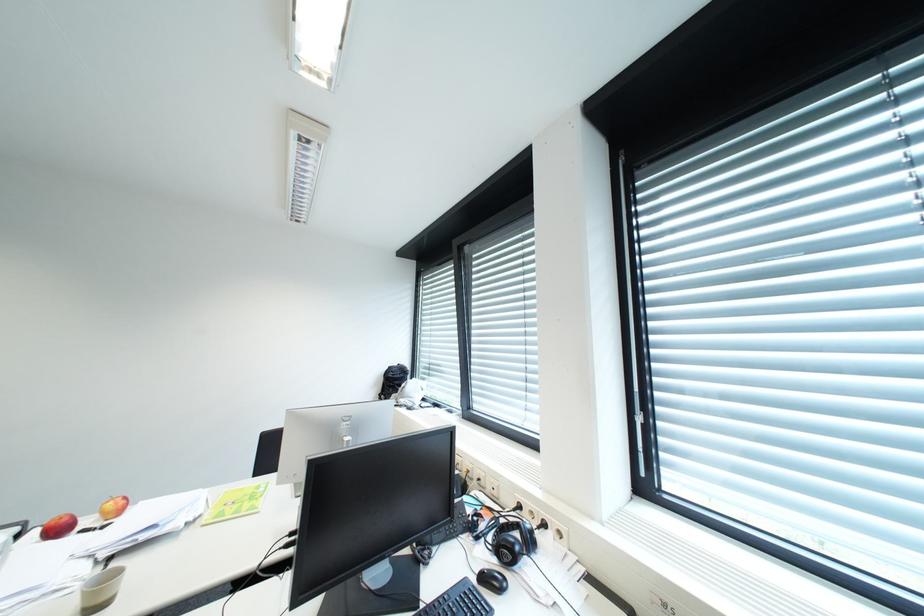
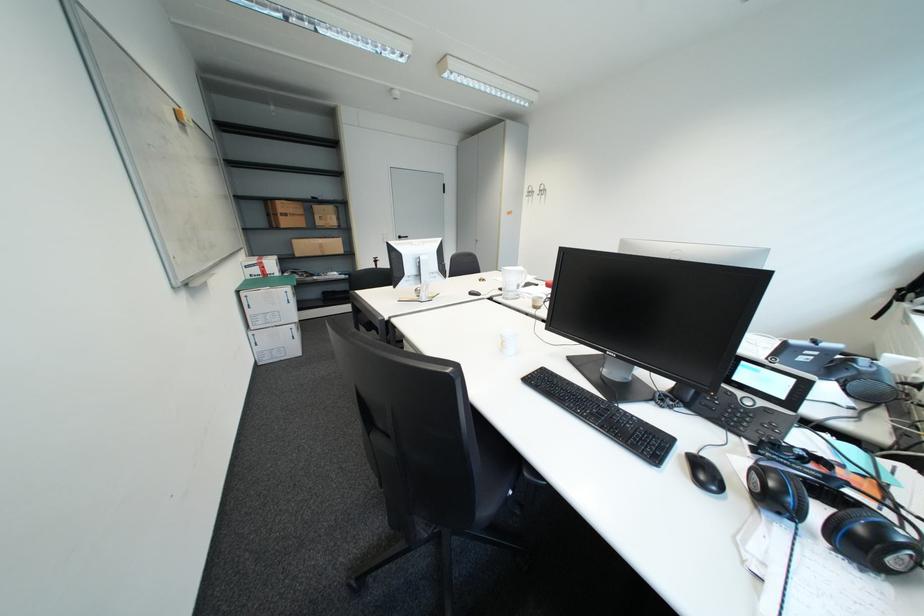
How did the camera likely rotate?

The camera rotated toward left-down.